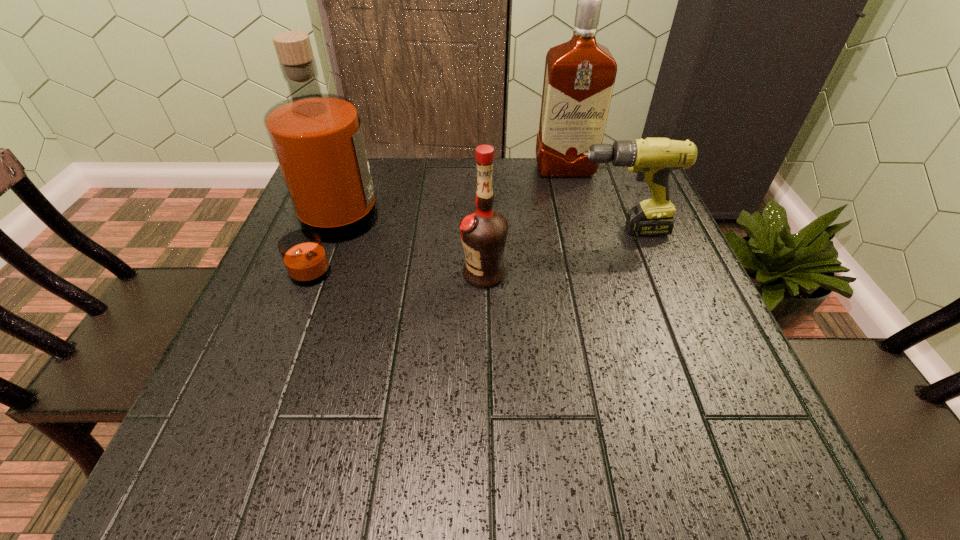
In order to click on vacant point located between the second liquor from left to right and the leftmost object in this screenshot , I will do pyautogui.click(x=409, y=255).

The image size is (960, 540). Find the location of `vacant point located between the second liquor from right to left and the leftmost object`. vacant point located between the second liquor from right to left and the leftmost object is located at coordinates (409, 255).

Select which object appears as the third closest to the third object from right to left. Please provide its 2D coordinates. Your answer should be formatted as a tuple, i.e. [(x, y)], where the tuple contains the x and y coordinates of a point satisfying the conditions above.

[(579, 77)]

Identify which object is the second closest to the drill. Please provide its 2D coordinates. Your answer should be formatted as a tuple, i.e. [(x, y)], where the tuple contains the x and y coordinates of a point satisfying the conditions above.

[(579, 77)]

The image size is (960, 540). Find the location of `the second closest liquor relative to the leftmost liquor`. the second closest liquor relative to the leftmost liquor is located at coordinates (579, 77).

Find the location of a particular element. The height and width of the screenshot is (540, 960). liquor that is the closest to the rightmost liquor is located at coordinates (484, 232).

At what (x,y) coordinates should I click in order to perform the action: click on vacant space that satisfies the following two spatial constraints: 1. on the front label of the farthest object; 2. on the front and back of the shortest liquor. Please return your answer as a coordinate pair (x, y). Looking at the image, I should click on (590, 273).

What are the coordinates of `vacant space that satisfies the following two spatial constraints: 1. on the front label of the rightmost liquor; 2. on the front and back of the shortest liquor` in the screenshot? It's located at (590, 273).